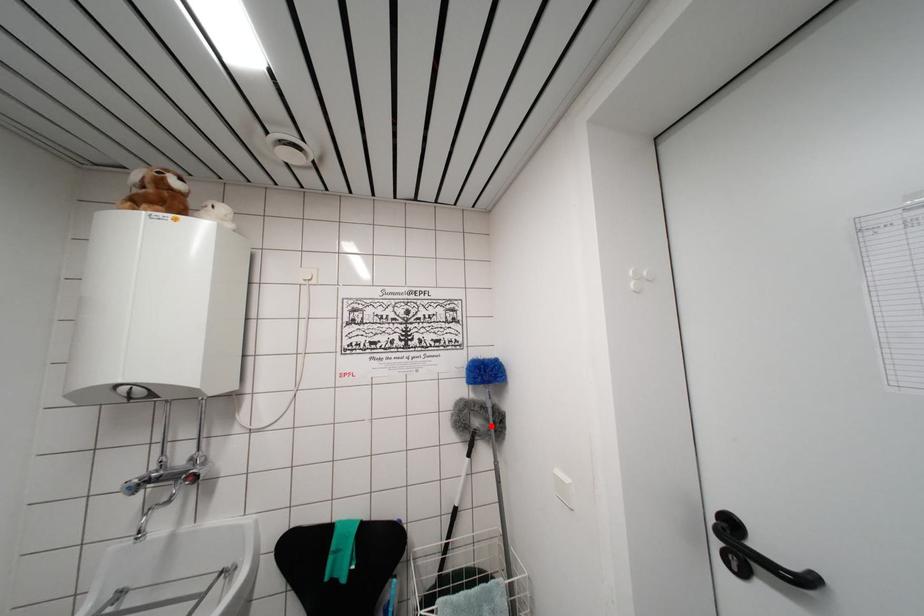
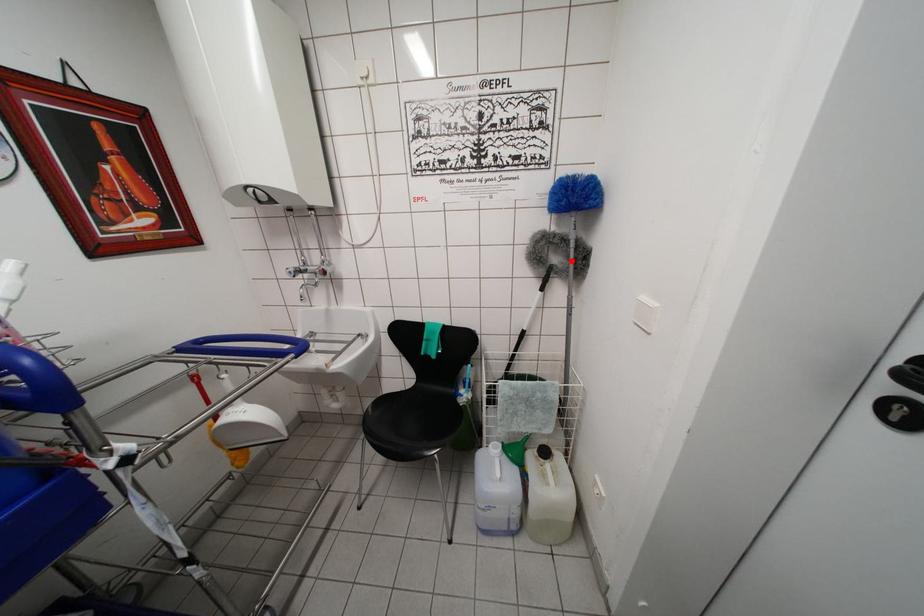
I am providing you with two images of the same scene from different viewpoints. A red point is marked on the first image and another point is marked on the second image. Does the point marked in image1 correspond to the same location as the one in image2?

Yes